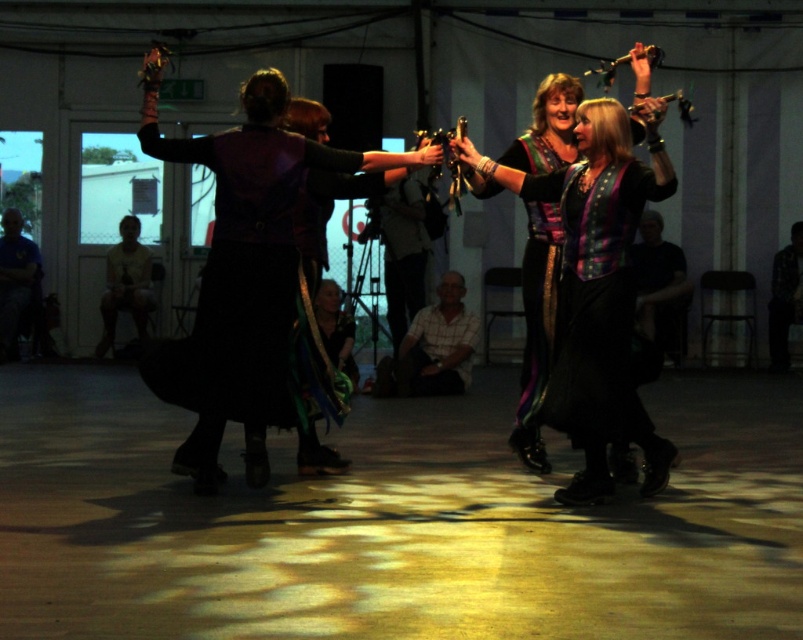
What do you see at coordinates (597, 288) in the screenshot? This screenshot has width=803, height=640. I see `shiny black vest at center` at bounding box center [597, 288].

Is point (598, 150) in front of point (7, 276)?

Yes, point (598, 150) is closer to viewer.

The width and height of the screenshot is (803, 640). Describe the element at coordinates (597, 288) in the screenshot. I see `shiny black vest at center` at that location.

At what (x,y) coordinates should I click in order to perform the action: click on shiny black vest at center. Please return your answer as a coordinate pair (x, y). Looking at the image, I should click on (597, 288).

Is dark gray shirt at center thinner than light yellow t-shirt at lower left?

Indeed, dark gray shirt at center has a lesser width compared to light yellow t-shirt at lower left.

Does dark gray shirt at center appear under light yellow t-shirt at lower left?

Yes.

The image size is (803, 640). What do you see at coordinates (659, 289) in the screenshot?
I see `dark gray shirt at center` at bounding box center [659, 289].

Locate an element on the screen. dark gray shirt at center is located at coordinates (659, 289).

Which is in front, point (238, 368) or point (124, 300)?

Point (238, 368) is more forward.

At what (x,y) coordinates should I click in order to perform the action: click on matte purple vest at center. Please return your answer as a coordinate pair (x, y). The height and width of the screenshot is (640, 803). Looking at the image, I should click on (243, 273).

Identify the location of matte purple vest at center. (x=243, y=273).